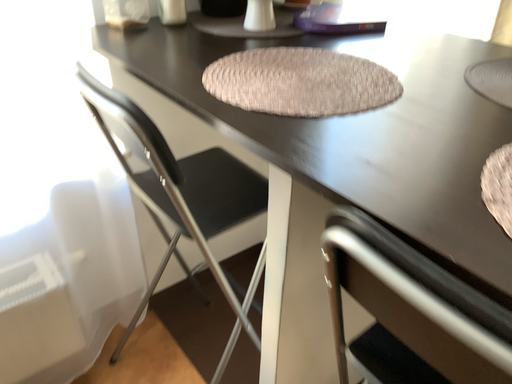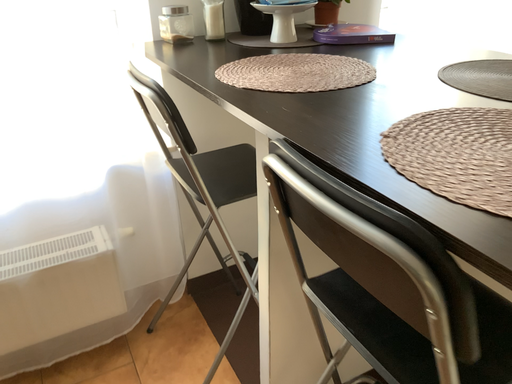
Question: Which way did the camera rotate in the video?

Choices:
 (A) rotated right
 (B) rotated left

Answer: (B)